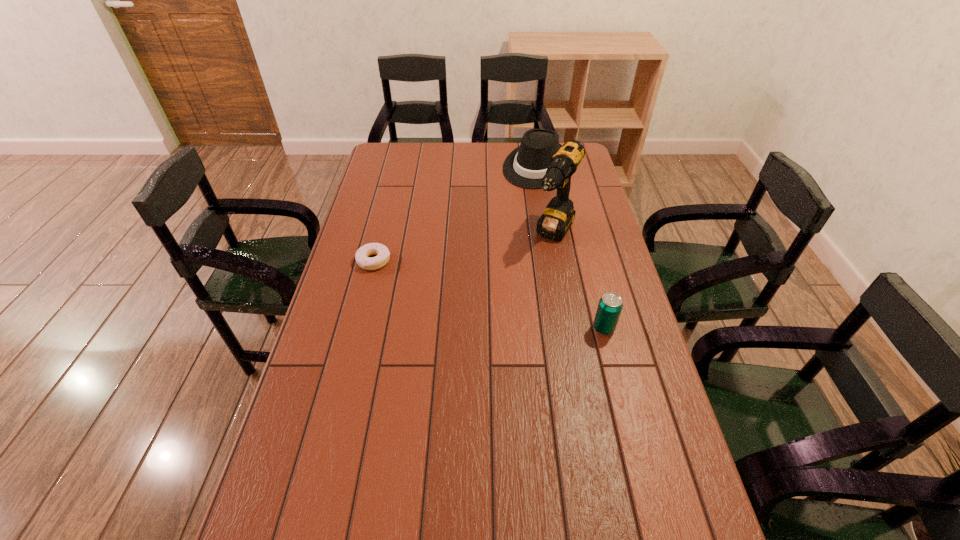
The width and height of the screenshot is (960, 540). Find the location of `free location located 0.130m on the front-facing side of the farthest object`. free location located 0.130m on the front-facing side of the farthest object is located at coordinates (514, 204).

Where is `free spot located on the front-facing side of the farthest object`? The width and height of the screenshot is (960, 540). free spot located on the front-facing side of the farthest object is located at coordinates (520, 195).

At what (x,y) coordinates should I click in order to perform the action: click on vacant space situated 0.070m on the front-facing side of the farthest object. Please return your answer as a coordinate pair (x, y). The width and height of the screenshot is (960, 540). Looking at the image, I should click on (519, 196).

Identify the location of object that is at the far edge. (526, 165).

Locate an element on the screen. This screenshot has width=960, height=540. object that is positioned at the left edge is located at coordinates (362, 258).

Find the location of a particular element. The height and width of the screenshot is (540, 960). beer can at the right edge is located at coordinates (610, 306).

This screenshot has width=960, height=540. I want to click on drill present at the right edge, so click(556, 220).

In order to click on fedora that is at the right edge in this screenshot , I will do `click(526, 165)`.

Where is `object present at the far right corner`? This screenshot has width=960, height=540. object present at the far right corner is located at coordinates (526, 165).

I want to click on vacant space at the far edge of the desktop, so click(418, 145).